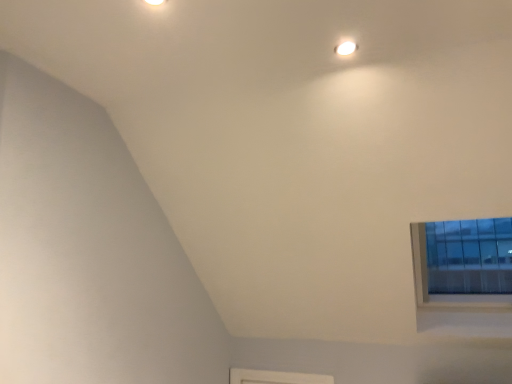
What do you see at coordinates (346, 48) in the screenshot? The width and height of the screenshot is (512, 384). I see `white glossy light fixture at upper center` at bounding box center [346, 48].

In order to face white glossy light fixture at upper center, should I rotate leftwards or rightwards?

You should rotate right by 11.685 degrees.

Locate an element on the screen. white glossy light fixture at upper center is located at coordinates (346, 48).

Find the location of `white glossy light fixture at upper center`. white glossy light fixture at upper center is located at coordinates (346, 48).